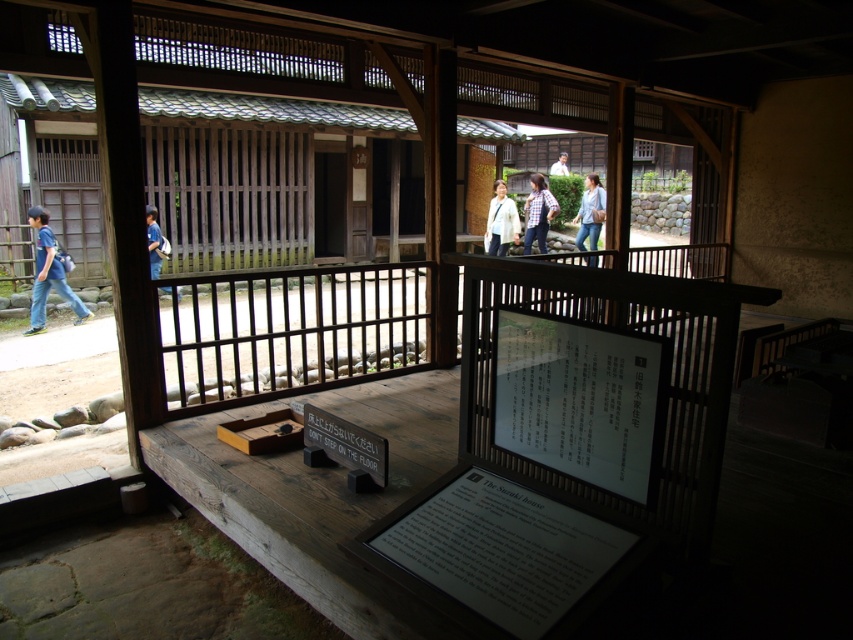
Is white paper at center closer to camera compared to blue fabric backpack at left?

Yes, it is.

Can you confirm if white paper at center is shorter than blue fabric backpack at left?

Indeed, white paper at center has a lesser height compared to blue fabric backpack at left.

Locate an element on the screen. This screenshot has width=853, height=640. white paper at center is located at coordinates (582, 401).

Can you confirm if white matte jacket at center is shorter than white matte shirt at upper center?

In fact, white matte jacket at center may be taller than white matte shirt at upper center.

Is white matte jacket at center bigger than white matte shirt at upper center?

Incorrect, white matte jacket at center is not larger than white matte shirt at upper center.

Is point (490, 225) positioned before point (558, 160)?

Yes.

What are the coordinates of `white matte jacket at center` in the screenshot? It's located at [x=502, y=221].

Is wooden signboard at center taller than blue fabric backpack at left?

In fact, wooden signboard at center may be shorter than blue fabric backpack at left.

Does point (482, 576) come closer to viewer compared to point (33, 323)?

That is True.

Locate an element on the screen. The width and height of the screenshot is (853, 640). wooden signboard at center is located at coordinates tap(503, 548).